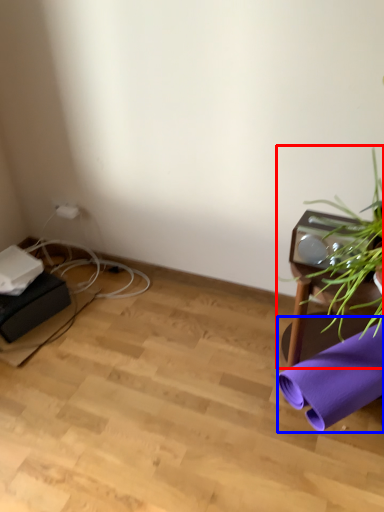
Question: Which object appears closest to the camera in this image, houseplant (highlighted by a red box) or beach towel (highlighted by a blue box)?

Choices:
 (A) houseplant
 (B) beach towel

Answer: (A)